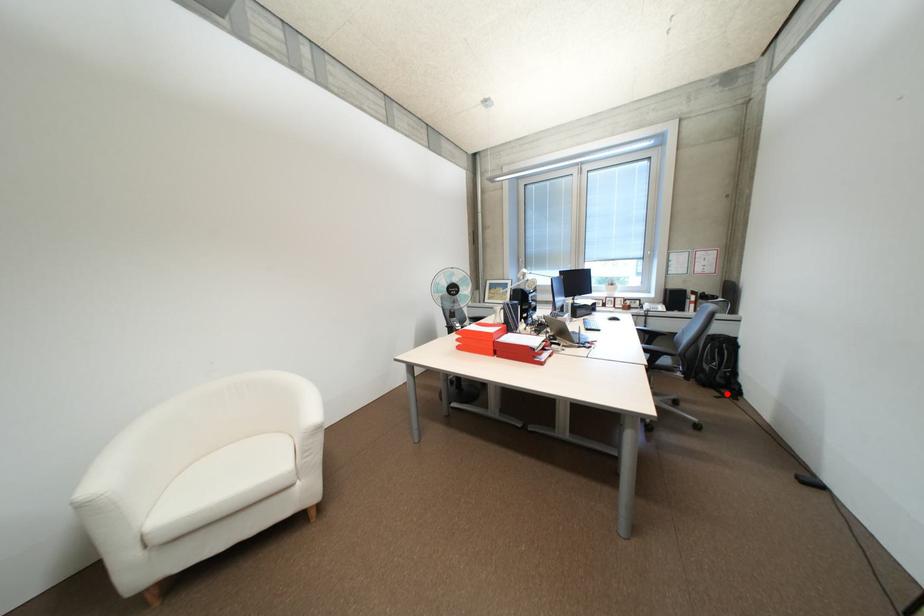
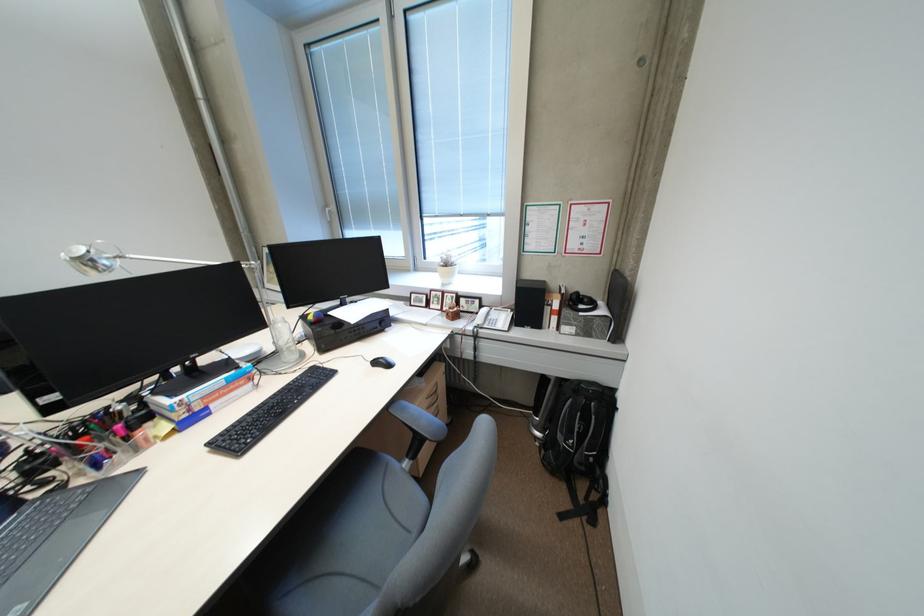
Find the pixel in the second image that matches the highlighted location in the first image.

(576, 501)